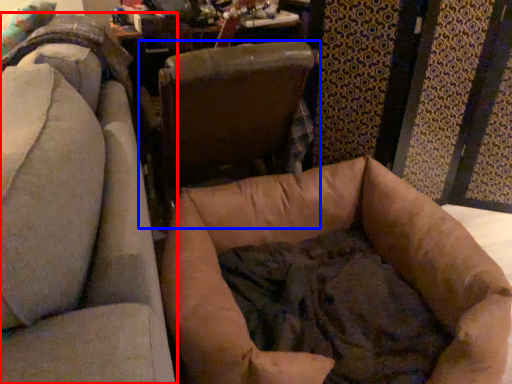
Question: Which of the following is the farthest to the observer, chair (highlighted by a red box) or chair (highlighted by a blue box)?

Choices:
 (A) chair
 (B) chair

Answer: (B)